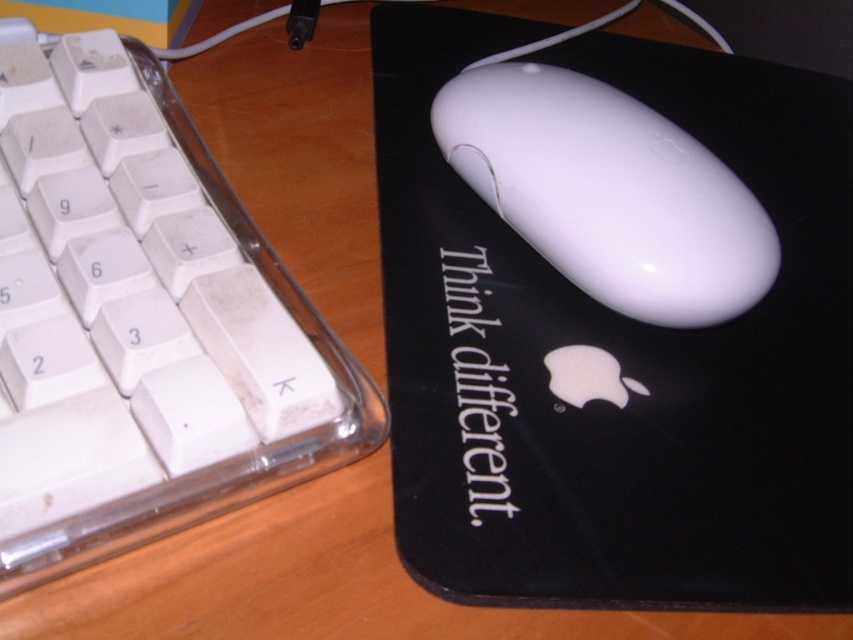
Looking at this image, you are a delivery robot approaching the desk. You need to place a package between the two points, point (851, 538) and point (496, 102). Since you can only place it in front of one of them, which point should you choose to ensure the package is closer to the front of the desk?

You should place the package in front of point (851, 538) because it is in front of point (496, 102), so placing it there would position the package closer to the front of the desk.

You are organizing your desk and want to place a new cup between the white plastic keyboard at left and the white glossy mouse at center. Based on their positions, which object should the cup be closer to?

The white plastic keyboard at left is closer to the viewer than the white glossy mouse at center, so the cup should be placed closer to the white plastic keyboard at left to maintain proximity.

You are a delivery person who needs to place a small package on the desk in the image. The package is 2 inches thick. If you want to place it so that it is closest to you, where should you position it relative to the point at coordinates point [780,452]?

The point at coordinates point [780,452] is 17.67 inches away from the viewer. To place the package closest to you, position it between the viewer and the point, ensuring it is within the 17.67 inches distance range.